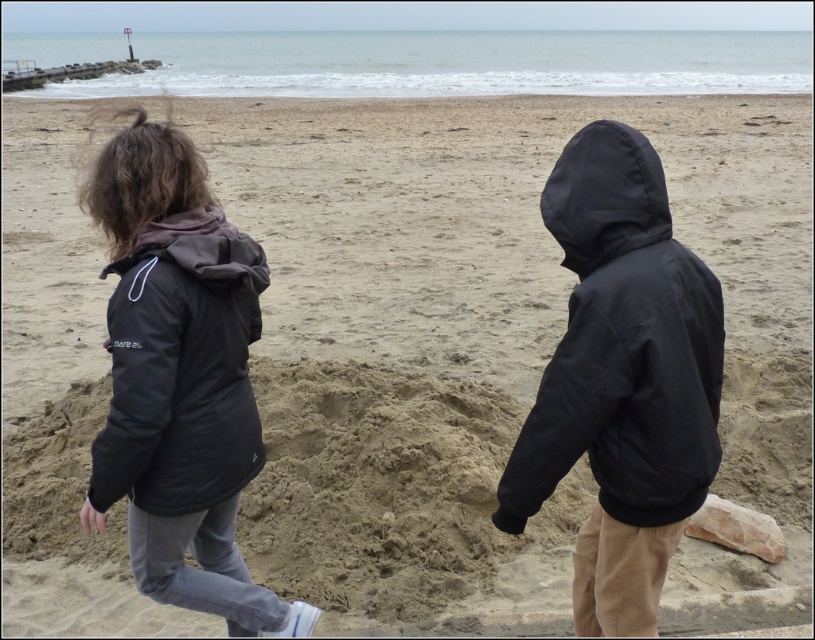
Question: Considering the real-world distances, which object is farthest from the black matte jacket at right?

Choices:
 (A) black matte jacket at left
 (B) black matte hood at upper right

Answer: (A)

Question: Among these objects, which one is nearest to the camera?

Choices:
 (A) black matte hood at upper right
 (B) black matte jacket at left
 (C) matte black jacket at left

Answer: (A)

Question: Does black matte jacket at right have a lesser width compared to black matte hood at upper right?

Choices:
 (A) no
 (B) yes

Answer: (A)

Question: Among these points, which one is farthest from the camera?

Choices:
 (A) (646, 236)
 (B) (243, 275)
 (C) (632, 225)

Answer: (B)

Question: Where is black matte jacket at right located in relation to black matte jacket at left in the image?

Choices:
 (A) below
 (B) above

Answer: (B)

Question: Is matte black jacket at left wider than black matte jacket at right?

Choices:
 (A) yes
 (B) no

Answer: (A)